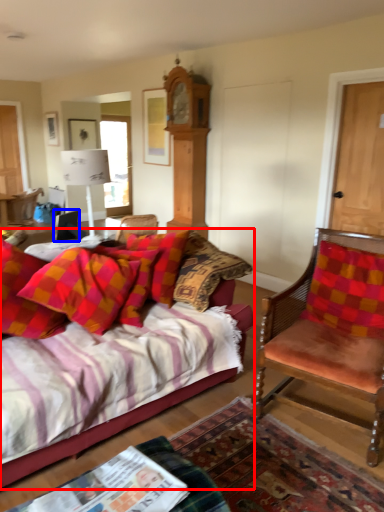
Question: Which of the following is the farthest to the observer, studio couch (highlighted by a red box) or corded phone (highlighted by a blue box)?

Choices:
 (A) studio couch
 (B) corded phone

Answer: (B)